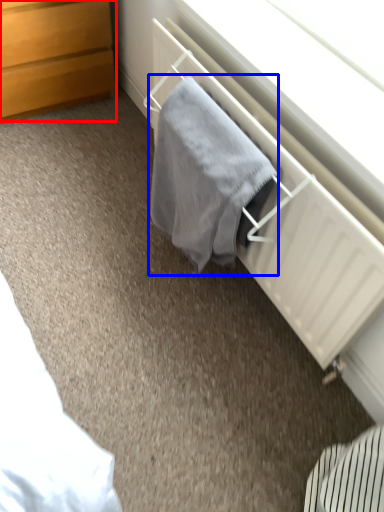
Question: Among these objects, which one is nearest to the camera, chest of drawers (highlighted by a red box) or bath towel (highlighted by a blue box)?

Choices:
 (A) chest of drawers
 (B) bath towel

Answer: (B)